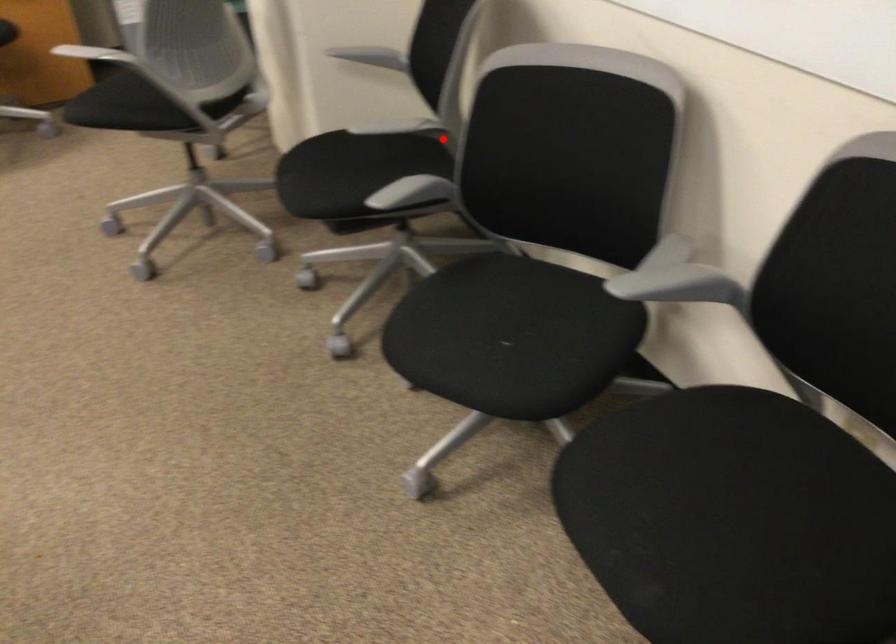
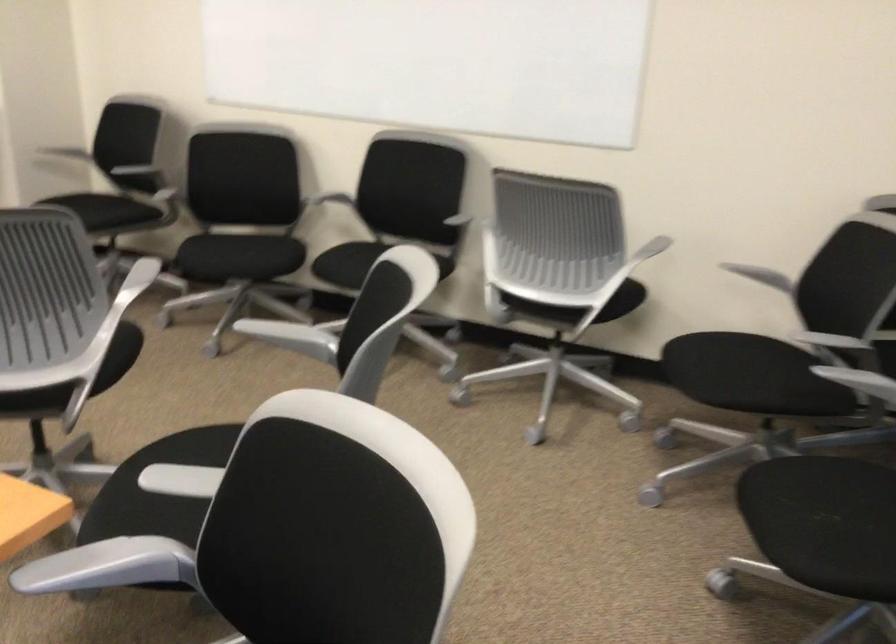
Where in the second image is the point corresponding to the highlighted location from the first image?

(152, 180)